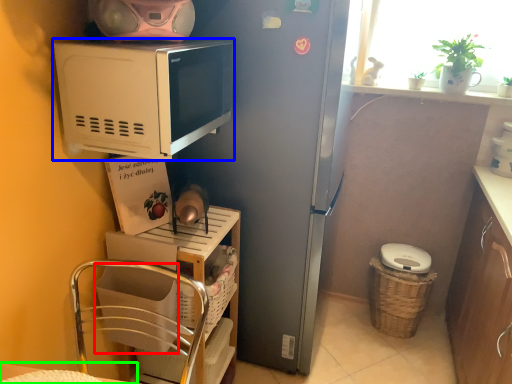
Question: Considering the real-world distances, which object is farthest from basket (highlighted by a red box)? microwave oven (highlighted by a blue box) or table (highlighted by a green box)?

Choices:
 (A) microwave oven
 (B) table

Answer: (A)